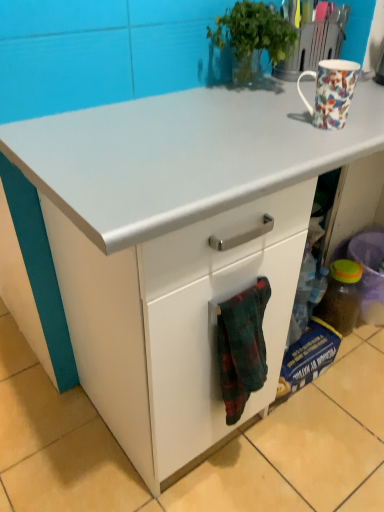
Question: Is the depth of floral porcelain mug at upper right less than that of translucent plastic bottle at lower right?

Choices:
 (A) no
 (B) yes

Answer: (B)

Question: Does floral porcelain mug at upper right have a smaller size compared to translucent plastic bottle at lower right?

Choices:
 (A) yes
 (B) no

Answer: (A)

Question: From the image's perspective, would you say floral porcelain mug at upper right is shown under translucent plastic bottle at lower right?

Choices:
 (A) no
 (B) yes

Answer: (A)

Question: Does floral porcelain mug at upper right have a larger size compared to translucent plastic bottle at lower right?

Choices:
 (A) yes
 (B) no

Answer: (B)

Question: Is floral porcelain mug at upper right oriented away from translucent plastic bottle at lower right?

Choices:
 (A) yes
 (B) no

Answer: (B)

Question: Does point (261, 307) appear closer or farther from the camera than point (276, 38)?

Choices:
 (A) closer
 (B) farther

Answer: (A)

Question: Is flannel fabric towel at lower center in front of or behind green leafy plant at upper center in the image?

Choices:
 (A) behind
 (B) front

Answer: (B)

Question: From a real-world perspective, is flannel fabric towel at lower center physically located above or below green leafy plant at upper center?

Choices:
 (A) above
 (B) below

Answer: (B)

Question: Based on their sizes in the image, would you say flannel fabric towel at lower center is bigger or smaller than green leafy plant at upper center?

Choices:
 (A) big
 (B) small

Answer: (B)

Question: In the image, is green leafy plant at upper center positioned in front of or behind floral porcelain mug at upper right?

Choices:
 (A) behind
 (B) front

Answer: (A)

Question: From a real-world perspective, is green leafy plant at upper center above or below floral porcelain mug at upper right?

Choices:
 (A) above
 (B) below

Answer: (A)

Question: From the image's perspective, is green leafy plant at upper center located above or below floral porcelain mug at upper right?

Choices:
 (A) below
 (B) above

Answer: (B)

Question: In terms of size, does green leafy plant at upper center appear bigger or smaller than floral porcelain mug at upper right?

Choices:
 (A) big
 (B) small

Answer: (A)

Question: In terms of width, does green leafy plant at upper center look wider or thinner when compared to flannel fabric towel at lower center?

Choices:
 (A) wide
 (B) thin

Answer: (A)

Question: Relative to flannel fabric towel at lower center, is green leafy plant at upper center in front or behind?

Choices:
 (A) behind
 (B) front

Answer: (A)